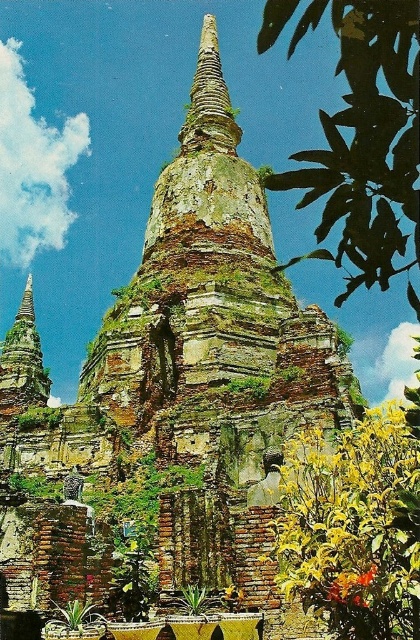
Is green leafy plant at upper right below yellow-green leafy plant at lower center?

No.

Is green leafy plant at upper right bigger than yellow-green leafy plant at lower center?

Indeed, green leafy plant at upper right has a larger size compared to yellow-green leafy plant at lower center.

The height and width of the screenshot is (640, 420). Identify the location of green leafy plant at upper right. (364, 141).